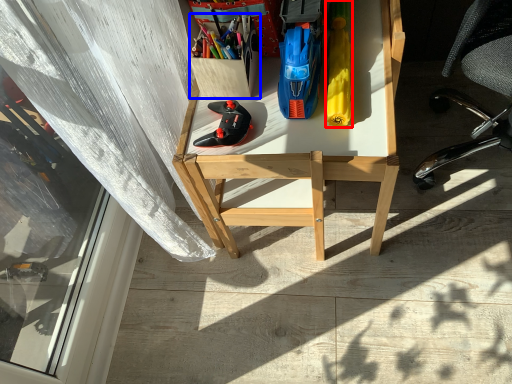
Question: Which object appears farthest to the camera in this image, stationery (highlighted by a red box) or stationery (highlighted by a blue box)?

Choices:
 (A) stationery
 (B) stationery

Answer: (B)